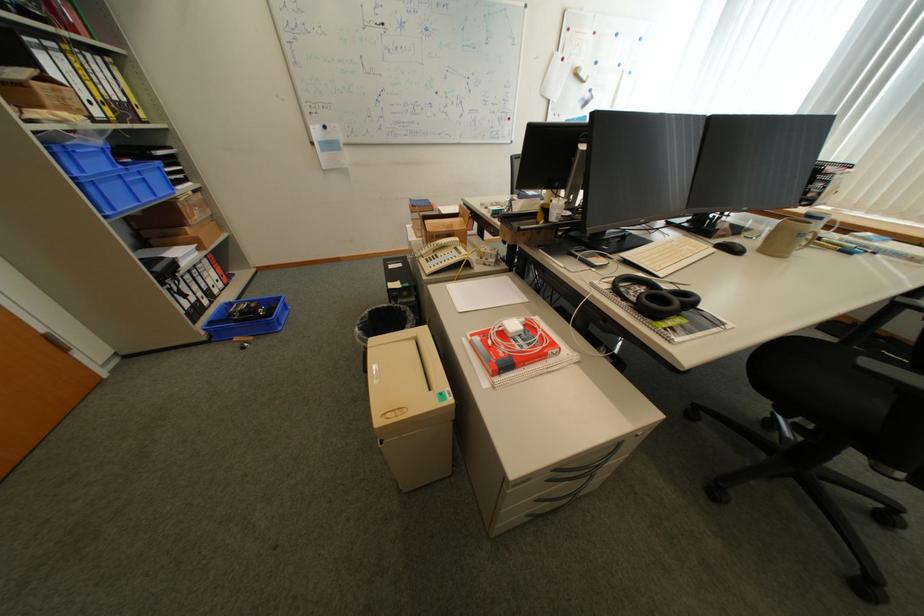
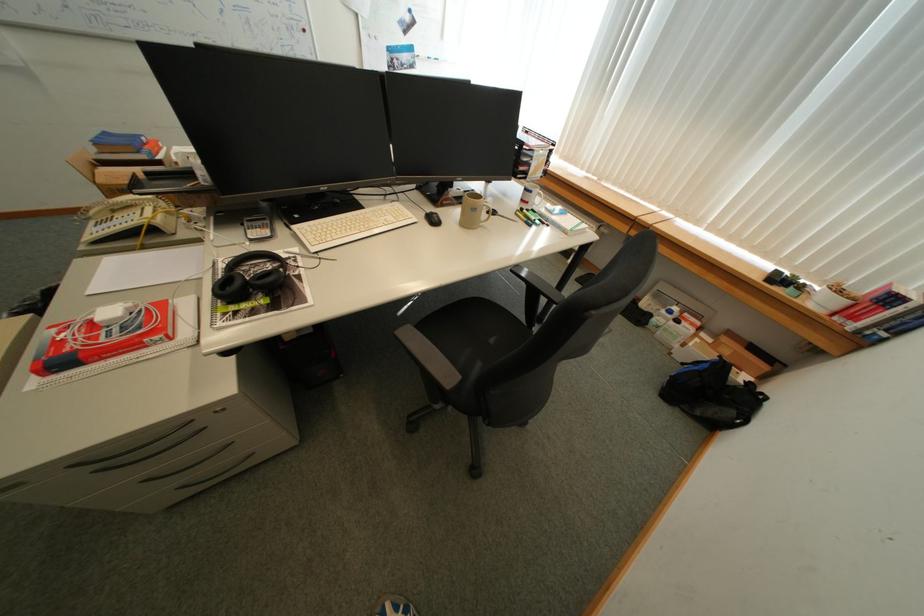
Find the pixel in the second image that matches point (531, 321) in the first image.

(140, 305)